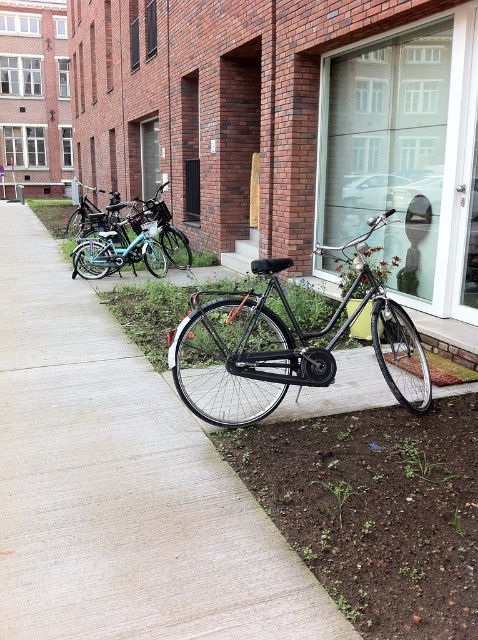
You are standing at the entrance of the building and want to reach the matte black bicycle at center. Which direction should you walk to get there?

Since the matte black bicycle at center is located at point (120, 484), you should walk forward and to the right to reach it.